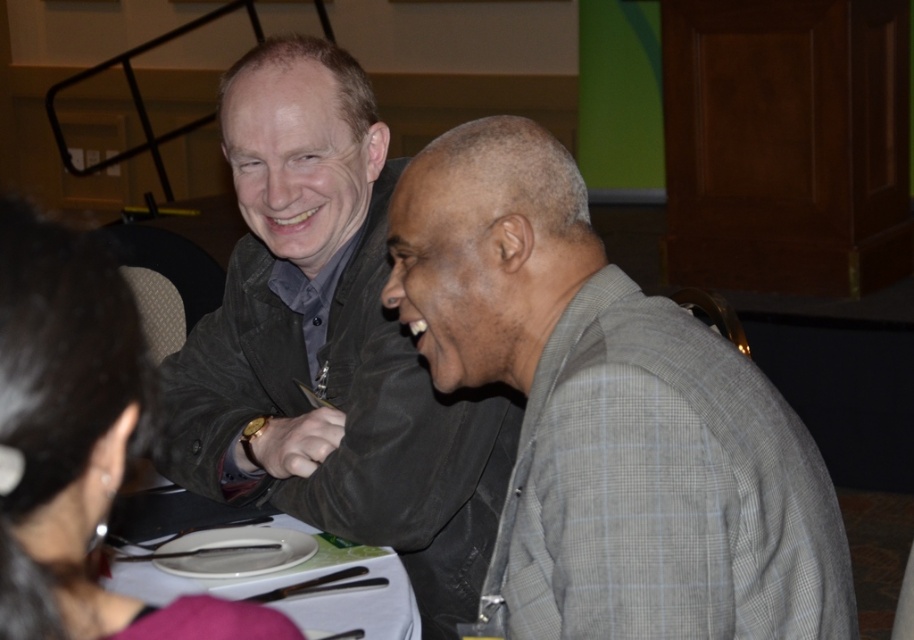
Question: In this image, where is gray checkered suit at right located relative to white glossy plate at center?

Choices:
 (A) above
 (B) below

Answer: (A)

Question: Which object is the closest to the dark gray jacket at center?

Choices:
 (A) white glossy plate at center
 (B) gray checkered suit at right

Answer: (A)

Question: Can you confirm if dark gray jacket at center is positioned to the right of white glossy plate at center?

Choices:
 (A) no
 (B) yes

Answer: (B)

Question: Which of these objects is positioned farthest from the white glossy plate at center?

Choices:
 (A) dark gray jacket at center
 (B) gray checkered suit at right

Answer: (B)

Question: Which object is farther from the camera taking this photo?

Choices:
 (A) white glossy plate at center
 (B) gray checkered suit at right

Answer: (A)

Question: Considering the relative positions of dark gray jacket at center and white glossy plate at center in the image provided, where is dark gray jacket at center located with respect to white glossy plate at center?

Choices:
 (A) right
 (B) left

Answer: (A)